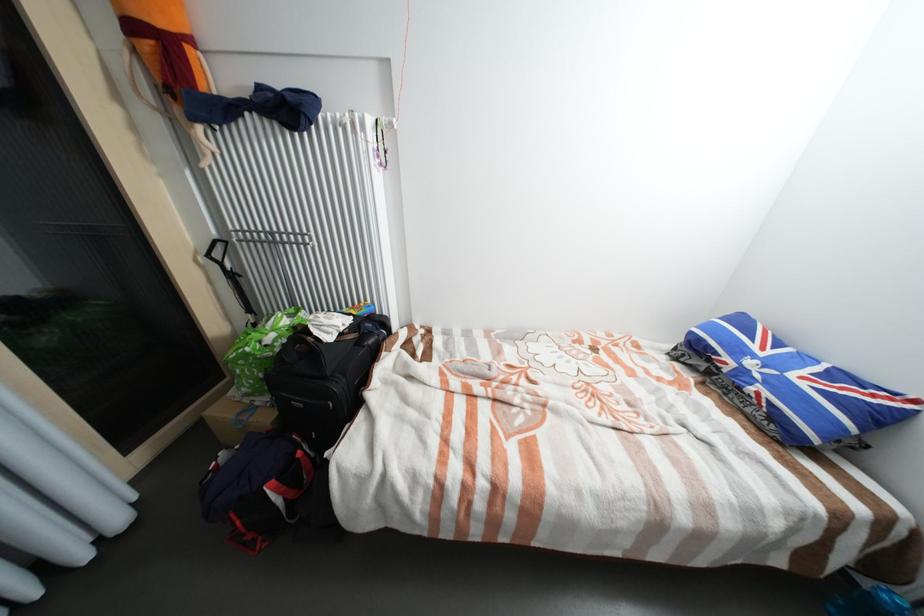
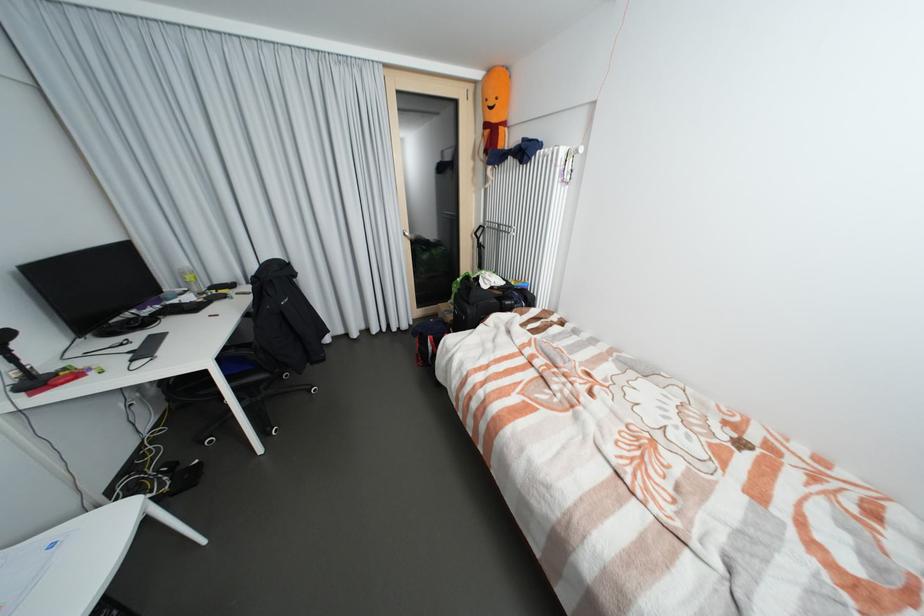
Where in the second image is the point corresponding to point 139,28 from the first image?

(492, 126)